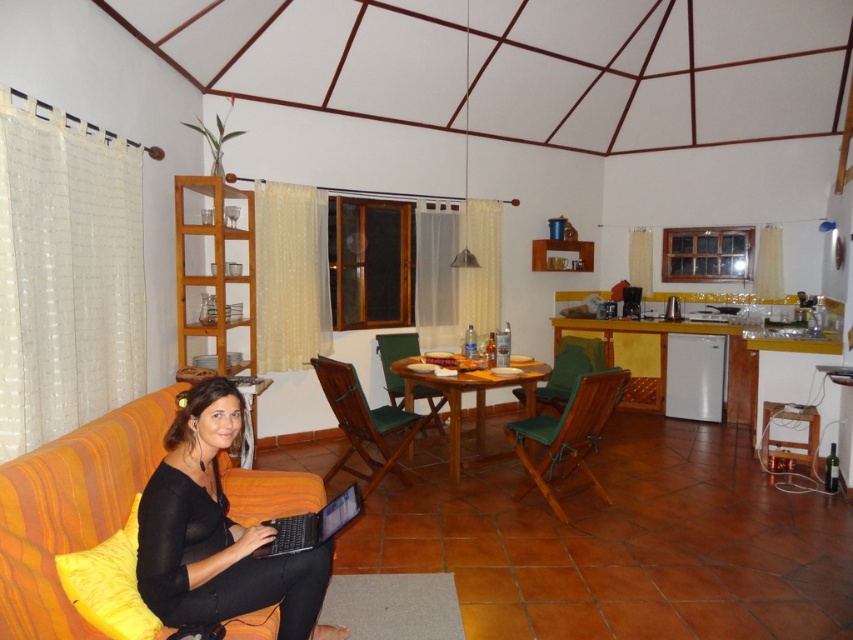
Does black matte laptop at lower left come behind wooden dining table at center?

That is False.

The width and height of the screenshot is (853, 640). What are the coordinates of `black matte laptop at lower left` in the screenshot? It's located at (218, 532).

Locate an element on the screen. black matte laptop at lower left is located at coordinates (218, 532).

Where is `black matte laptop at lower left`? This screenshot has width=853, height=640. black matte laptop at lower left is located at coordinates (218, 532).

Does point (529, 388) come in front of point (329, 524)?

That is False.

I want to click on wooden dining table at center, so click(467, 392).

Is point (186, 460) in front of point (315, 541)?

Yes, point (186, 460) is closer to viewer.

Between black matte laptop at lower left and black plastic laptop at lower left, which one is positioned higher?

black matte laptop at lower left is above.

Between point (311, 627) and point (280, 536), which one is positioned behind?

Point (280, 536)

Where is `black matte laptop at lower left`? The width and height of the screenshot is (853, 640). black matte laptop at lower left is located at coordinates (218, 532).